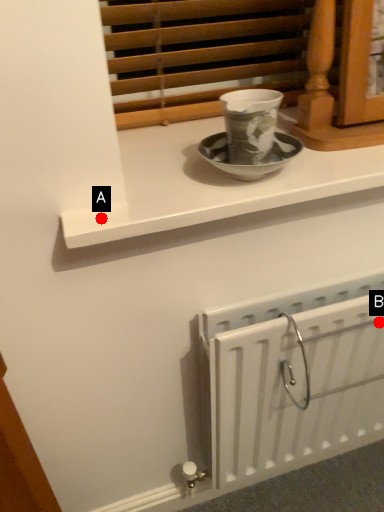
Question: Two points are circled on the image, labeled by A and B beside each circle. Which point is closer to the camera?

Choices:
 (A) A is closer
 (B) B is closer

Answer: (A)